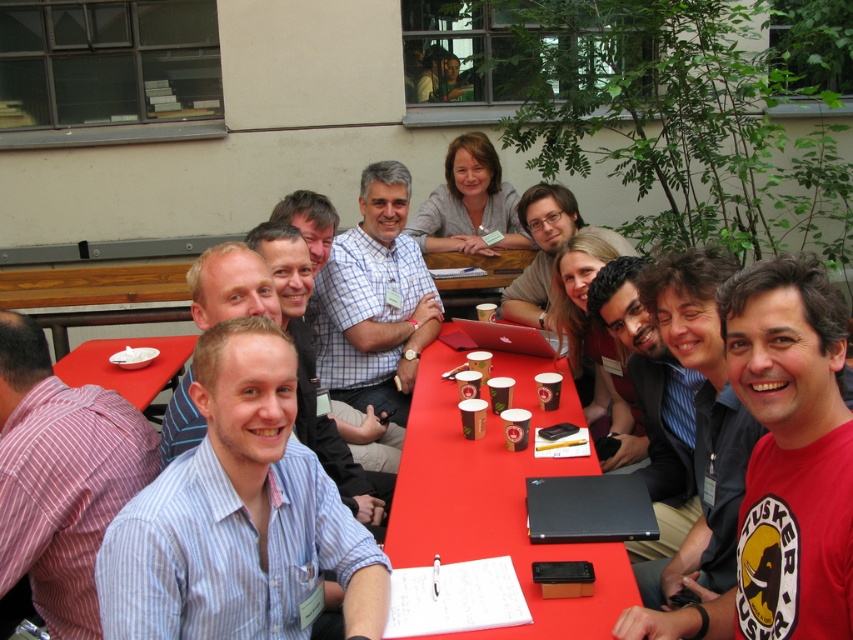
You are a photographer at the event, and you want to capture a photo of the two people wearing the blue striped shirt at center and the white checkered shirt at center. Since you can only focus on one person at a time, which shirt should you focus on first if you want to start from the left side of the table?

You should focus on the blue striped shirt at center first because it is located to the left of the white checkered shirt at center, making it closer to the left side of the table.